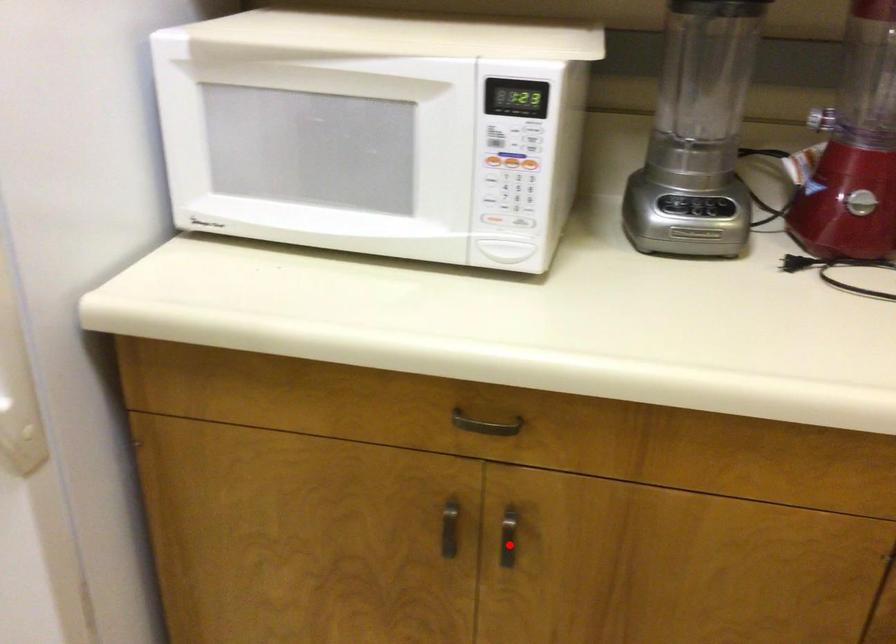
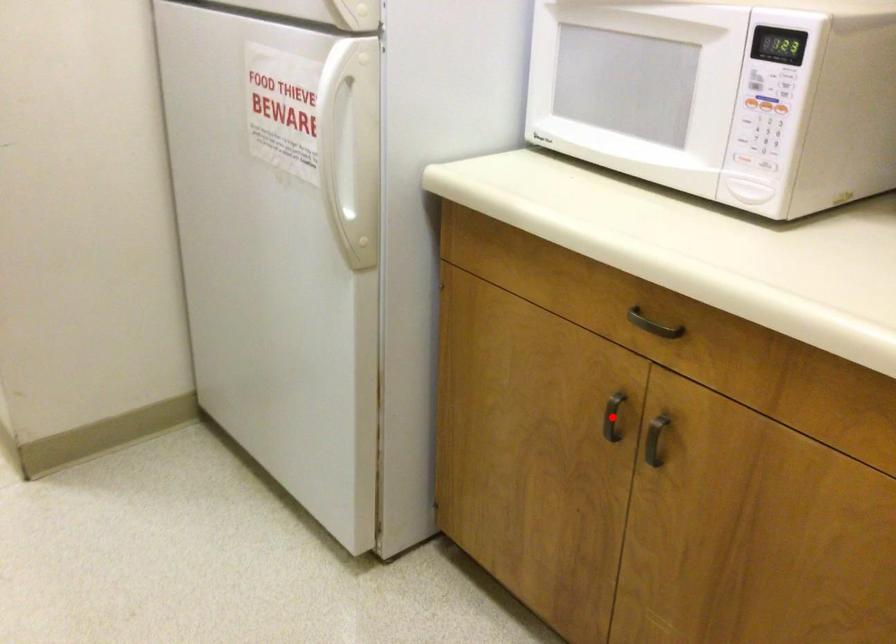
I am providing you with two images of the same scene from different viewpoints. A red point is marked on the first image and another point is marked on the second image. Is the red point in image1 aligned with the point shown in image2?

No